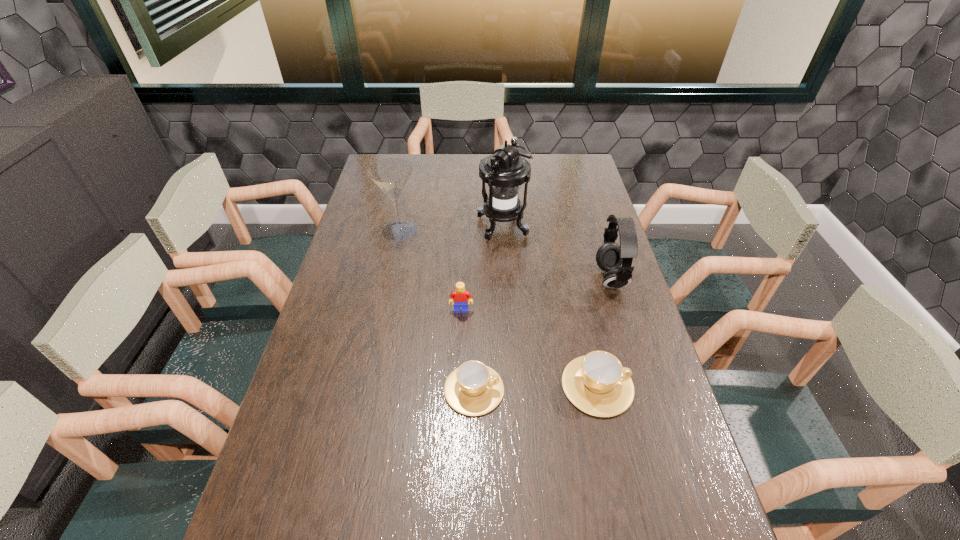
At what (x,y) coordinates should I click in order to perform the action: click on the shorter cup. Please return your answer as a coordinate pair (x, y). The image size is (960, 540). Looking at the image, I should click on (473, 389).

Where is `the shortest object`? This screenshot has height=540, width=960. the shortest object is located at coordinates (473, 389).

This screenshot has width=960, height=540. I want to click on the taller cup, so click(x=597, y=384).

Locate an element on the screen. Image resolution: width=960 pixels, height=540 pixels. the second shortest object is located at coordinates (597, 384).

Identify the location of the leftmost object. (391, 175).

Locate an element on the screen. This screenshot has height=540, width=960. the tallest object is located at coordinates (504, 171).

Locate an element on the screen. the third farthest object is located at coordinates (610, 256).

Find the location of a particular element. This screenshot has height=540, width=960. Lego is located at coordinates (460, 296).

I want to click on the fourth tallest object, so click(460, 296).

Image resolution: width=960 pixels, height=540 pixels. What are the coordinates of `vacant space located 0.370m with the handle on the side of the shortest object` in the screenshot? It's located at (651, 389).